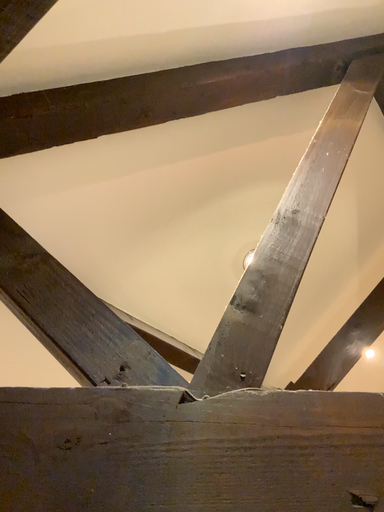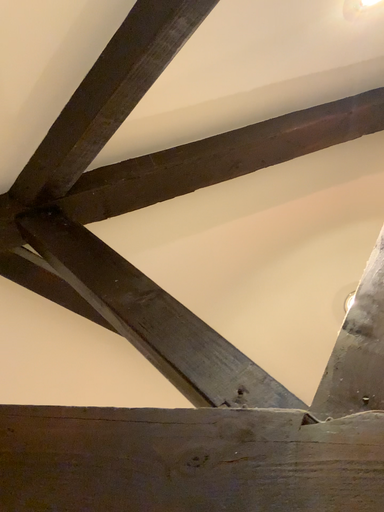
Question: How did the camera likely rotate when shooting the video?

Choices:
 (A) rotated right
 (B) rotated left

Answer: (B)